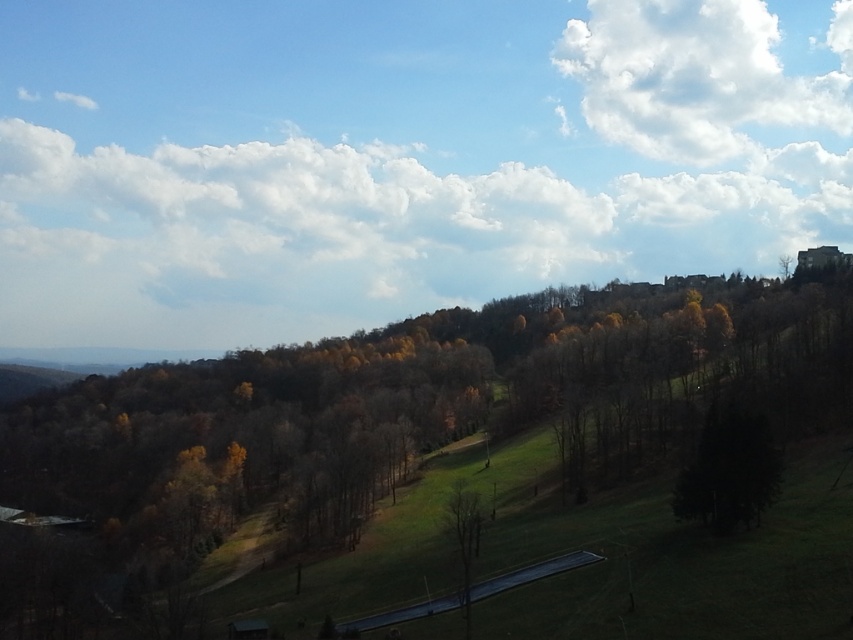
You are a bird flying at an altitude of 1000 feet. You see a white fluffy cloud at upper right and want to land on it. Can you reach it based on your current altitude?

The white fluffy cloud at upper right is 2074.21 feet away from you, so you cannot reach it since your altitude is only 1000 feet.

You are standing in the middle of the grassy area and want to take a photo of the brown matte tree at center and the white fluffy cloud at upper right. Which object should you point your camera towards first if you want to capture both in one frame without moving your position?

You should point your camera towards the brown matte tree at center first since it is closer to you than the white fluffy cloud at upper right, allowing both to be in the same frame.

You are an artist planning to paint the scene. You want to ensure the brown matte tree at center and white fluffy cloud at upper right are proportionally accurate. Which object should you make wider in your painting?

The brown matte tree at center should be made wider in the painting because its width surpasses that of the white fluffy cloud at upper right according to the description.